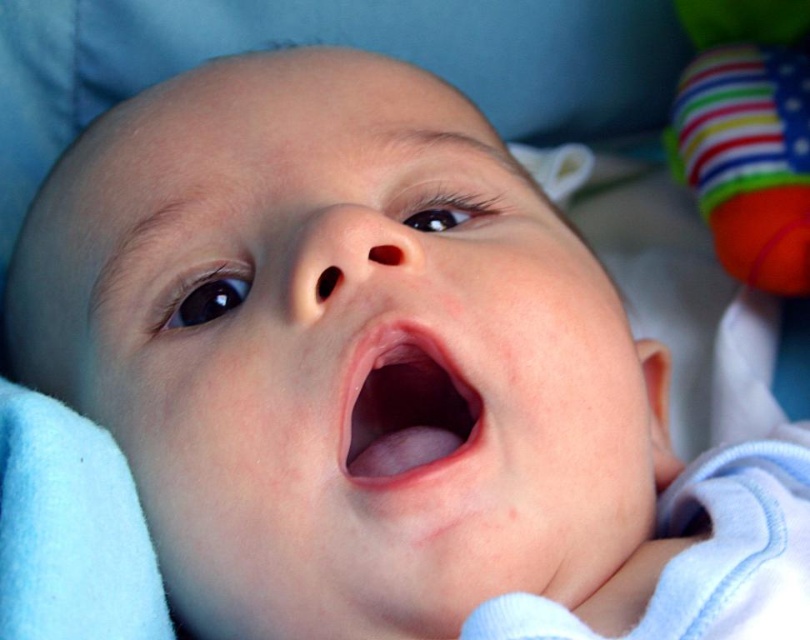
You are a photographer taking a picture of the baby. The multicolored fabric ball at upper right and the pink smooth flesh at center are in the frame. Which object is closer to the camera?

The multicolored fabric ball at upper right is closer to the camera because the pink smooth flesh at center is behind it.

You are a photographer taking a picture of the baby. The multicolored fabric ball at upper right is at point (747, 134). If you want to focus on the baby while keeping the ball in the frame, where should you position your camera?

The multicolored fabric ball at upper right is located at point (747, 134). To focus on the baby while keeping the ball in the frame, position the camera so that the baby is centered and the ball remains visible in the upper right corner at point (747, 134).

Based on the scene description, can you determine which object is larger between the multicolored fabric ball at upper right and the pink smooth flesh at center?

The multicolored fabric ball at upper right is bigger than the pink smooth flesh at center.